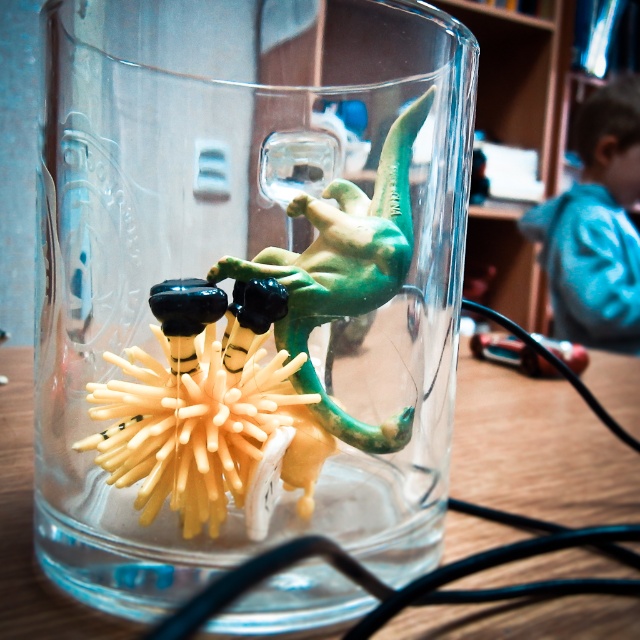
How much distance is there between transparent glass jar at center and blue denim shirt at upper right?

A distance of 26.71 centimeters exists between transparent glass jar at center and blue denim shirt at upper right.

Measure the distance between point (147, 323) and camera.

Point (147, 323) is 5.01 inches away from camera.

Find the location of `transparent glass jar at center`. transparent glass jar at center is located at coordinates (248, 285).

Is transparent glass jar at center closer to the viewer compared to wooden table at center?

Yes, transparent glass jar at center is closer to the viewer.

Where is `transparent glass jar at center`? This screenshot has height=640, width=640. transparent glass jar at center is located at coordinates (248, 285).

You are a GUI agent. You are given a task and a screenshot of the screen. Output one action in this format:
    pyautogui.click(x=<x>, y=<y>)
    Task: Click on the wooden table at center
    This screenshot has height=640, width=640.
    Given the screenshot: What is the action you would take?
    pyautogui.click(x=536, y=449)

Does point (1, 518) come behind point (564, 228)?

No, (1, 518) is in front of (564, 228).

Is point (560, 440) closer to viewer compared to point (632, 177)?

Yes.

Identify the location of wooden table at center. The height and width of the screenshot is (640, 640). (536, 449).